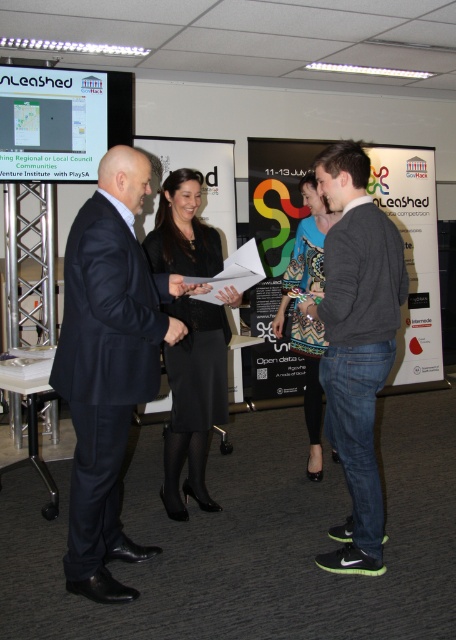
You are organizing a closet space and need to place the dark blue suit at center and the black satin skirt at center. Given their sizes, which one should you place first to maximize space efficiency?

The dark blue suit at center is larger in size than the black satin skirt at center, so you should place the dark blue suit at center first to make room for the smaller item.

You are organizing a photo shoot and need to ensure that the dark gray sweater at center and the matte black screen at upper left are visible in the frame. Given their sizes, which object should you prioritize positioning closer to the camera to ensure clarity?

The dark gray sweater at center has a lesser width compared to the matte black screen at upper left, so you should prioritize positioning the dark gray sweater at center closer to the camera to ensure its details are clearly visible.